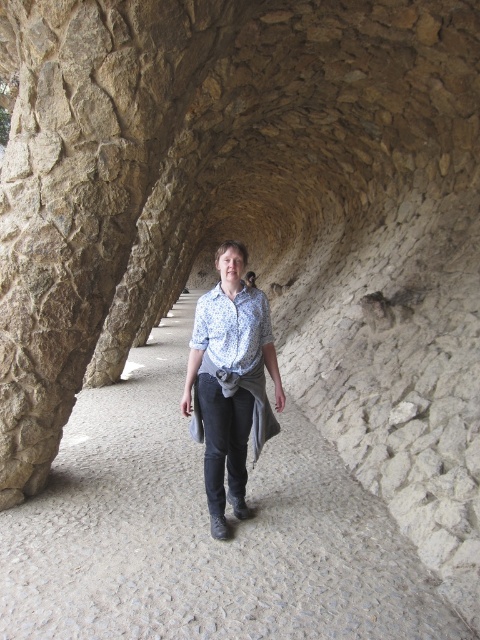
Question: Does gray cobblestone path at center appear on the right side of blue printed shirt at center?

Choices:
 (A) no
 (B) yes

Answer: (A)

Question: From the image, what is the correct spatial relationship of printed cotton shirt at center in relation to blue printed shirt at center?

Choices:
 (A) left
 (B) right

Answer: (A)

Question: Does gray cobblestone path at center appear under blue printed shirt at center?

Choices:
 (A) no
 (B) yes

Answer: (B)

Question: Based on their relative distances, which object is nearer to the gray cobblestone path at center?

Choices:
 (A) printed cotton shirt at center
 (B) blue printed shirt at center

Answer: (A)

Question: Which point is farther to the camera?

Choices:
 (A) (336, 476)
 (B) (223, 496)
 (C) (262, 307)

Answer: (A)

Question: Which point is farther to the camera?

Choices:
 (A) gray cobblestone path at center
 (B) blue printed shirt at center
 (C) printed cotton shirt at center

Answer: (B)